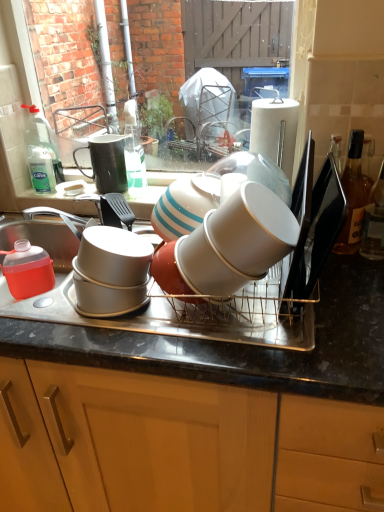
Image resolution: width=384 pixels, height=512 pixels. In order to click on vacant area in front of brown glass bottle at right, positioned as the second bottle in right-to-left order in this screenshot , I will do `click(350, 281)`.